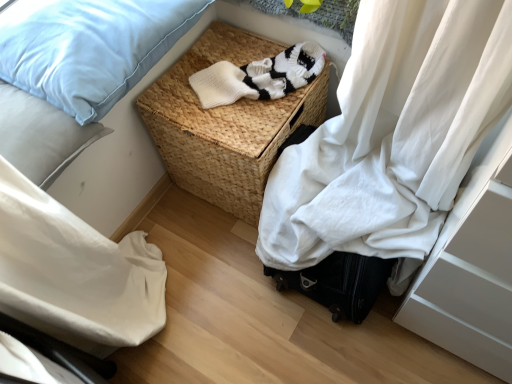
Question: Is woven brown picnic basket at center wider than light blue fabric pillow at upper left, the 1th pillow positioned from the top?

Choices:
 (A) no
 (B) yes

Answer: (A)

Question: Does woven brown picnic basket at center have a greater height compared to light blue fabric pillow at upper left, acting as the 2th pillow starting from the bottom?

Choices:
 (A) no
 (B) yes

Answer: (B)

Question: From a real-world perspective, is woven brown picnic basket at center located beneath light blue fabric pillow at upper left, acting as the 2th pillow starting from the bottom?

Choices:
 (A) no
 (B) yes

Answer: (B)

Question: Is woven brown picnic basket at center bigger than light blue fabric pillow at upper left, acting as the 2th pillow starting from the bottom?

Choices:
 (A) no
 (B) yes

Answer: (B)

Question: From the image's perspective, is woven brown picnic basket at center on light blue fabric pillow at upper left, acting as the 2th pillow starting from the bottom?

Choices:
 (A) yes
 (B) no

Answer: (B)

Question: Does point (188, 132) appear closer or farther from the camera than point (2, 117)?

Choices:
 (A) closer
 (B) farther

Answer: (B)

Question: Is woven brown picnic basket at center in front of or behind light blue fabric pillow at upper left, which is the first pillow from bottom to top, in the image?

Choices:
 (A) behind
 (B) front

Answer: (A)

Question: Is woven brown picnic basket at center to the left or to the right of light blue fabric pillow at upper left, which is the first pillow from bottom to top, in the image?

Choices:
 (A) left
 (B) right

Answer: (B)

Question: Is woven brown picnic basket at center taller or shorter than light blue fabric pillow at upper left, which is the first pillow from bottom to top?

Choices:
 (A) short
 (B) tall

Answer: (B)

Question: Is light blue fabric pillow at upper left, acting as the 2th pillow starting from the bottom, in front of or behind light blue fabric pillow at upper left, which is the first pillow from bottom to top, in the image?

Choices:
 (A) behind
 (B) front

Answer: (A)

Question: Is light blue fabric pillow at upper left, the 1th pillow positioned from the top, to the left or to the right of light blue fabric pillow at upper left, which is the first pillow from bottom to top, in the image?

Choices:
 (A) left
 (B) right

Answer: (B)

Question: From their relative heights in the image, would you say light blue fabric pillow at upper left, the 1th pillow positioned from the top, is taller or shorter than light blue fabric pillow at upper left, which is the first pillow from bottom to top?

Choices:
 (A) short
 (B) tall

Answer: (A)

Question: Considering the positions of point (99, 107) and point (80, 139), is point (99, 107) closer or farther from the camera than point (80, 139)?

Choices:
 (A) farther
 (B) closer

Answer: (A)

Question: Is light blue fabric pillow at upper left, acting as the 2th pillow starting from the bottom, inside or outside of white knitted sweater at center?

Choices:
 (A) inside
 (B) outside

Answer: (B)

Question: Is point coord(148,44) closer or farther from the camera than point coord(308,61)?

Choices:
 (A) farther
 (B) closer

Answer: (B)